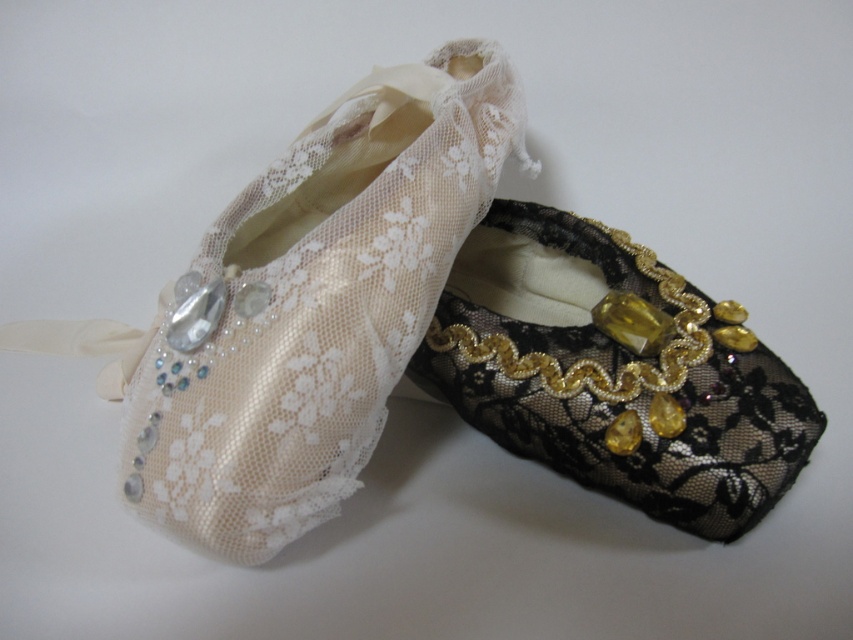
Question: Which point is farther from the camera taking this photo?

Choices:
 (A) (519, 422)
 (B) (192, 420)

Answer: (A)

Question: Observing the image, what is the correct spatial positioning of ivory lace slipper at left in reference to black lace slipper at right?

Choices:
 (A) below
 (B) above

Answer: (B)

Question: Which point appears farthest from the camera in this image?

Choices:
 (A) (399, 264)
 (B) (527, 339)

Answer: (B)

Question: Is the position of ivory lace slipper at left more distant than that of black lace slipper at right?

Choices:
 (A) yes
 (B) no

Answer: (B)

Question: Does ivory lace slipper at left appear on the right side of black lace slipper at right?

Choices:
 (A) yes
 (B) no

Answer: (B)